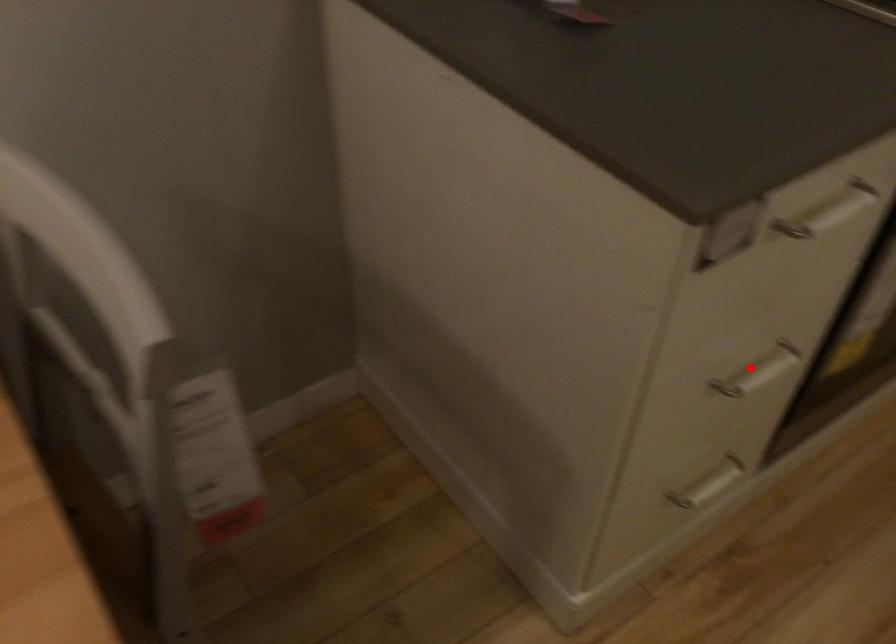
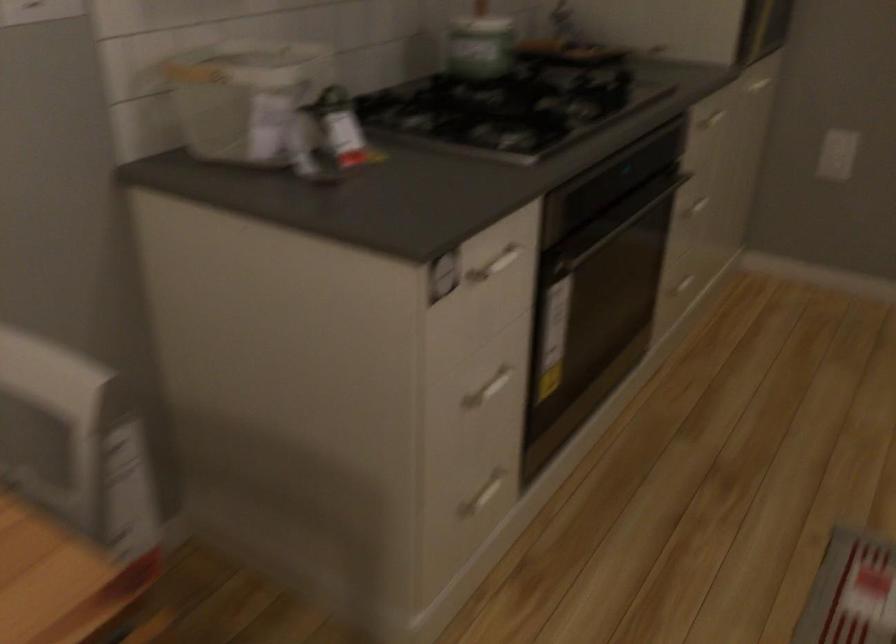
Question: I am providing you with two images of the same scene from different viewpoints. In image1, a red point is highlighted. Considering the same 3D point in image2, which of the following is correct?

Choices:
 (A) It is closer
 (B) It is farther

Answer: (B)